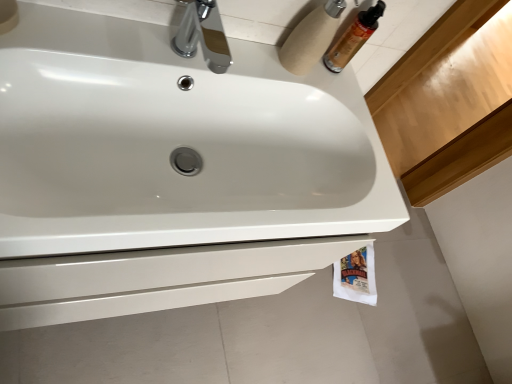
Question: Considering the relative positions of white glossy sink at center and white cardboard toilet paper at upper right, placed as the 2th toilet paper when sorted from back to front, in the image provided, is white glossy sink at center to the left or to the right of white cardboard toilet paper at upper right, placed as the 2th toilet paper when sorted from back to front,?

Choices:
 (A) left
 (B) right

Answer: (A)

Question: Relative to white cardboard toilet paper at upper right, arranged as the 1th toilet paper when viewed from the front, is white glossy sink at center in front or behind?

Choices:
 (A) behind
 (B) front

Answer: (B)

Question: Based on their relative distances, which object is nearer to the white paper towel at lower right, the first toilet paper ordered from the bottom?

Choices:
 (A) white glossy sink at center
 (B) translucent plastic mouthwash at upper right
 (C) white cardboard toilet paper at upper right, placed as the 2th toilet paper when sorted from back to front
 (D) chrome metallic faucet at upper center

Answer: (B)

Question: Considering the real-world distances, which object is farthest from the white glossy sink at center?

Choices:
 (A) chrome metallic faucet at upper center
 (B) white paper towel at lower right, acting as the first toilet paper starting from the back
 (C) white cardboard toilet paper at upper right, placed as the second toilet paper when sorted from bottom to top
 (D) translucent plastic mouthwash at upper right

Answer: (B)